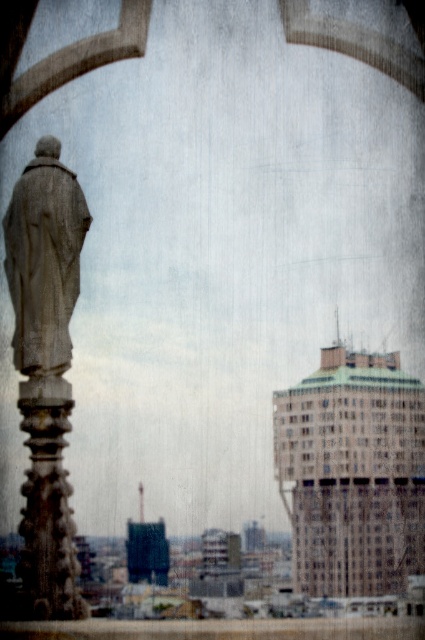
Who is lower down, stone statue at left or gray stone statue at left?

Positioned lower is stone statue at left.

Between stone statue at left and gray stone statue at left, which one has more height?

stone statue at left

What do you see at coordinates (45, 368) in the screenshot? I see `stone statue at left` at bounding box center [45, 368].

Find the location of a particular element. stone statue at left is located at coordinates (45, 368).

Is stone statue at left to the right of carved stone pillar at left from the viewer's perspective?

In fact, stone statue at left is to the left of carved stone pillar at left.

Who is higher up, stone statue at left or carved stone pillar at left?

stone statue at left

You are a GUI agent. You are given a task and a screenshot of the screen. Output one action in this format:
    pyautogui.click(x=<x>, y=<y>)
    Task: Click on the stone statue at left
    Image resolution: width=425 pixels, height=640 pixels.
    Given the screenshot: What is the action you would take?
    pyautogui.click(x=45, y=368)

How much distance is there between gray stone statue at left and carved stone pillar at left?

7.34 meters

Is gray stone statue at left smaller than carved stone pillar at left?

No, gray stone statue at left is not smaller than carved stone pillar at left.

Locate an element on the screen. This screenshot has height=640, width=425. gray stone statue at left is located at coordinates (44, 259).